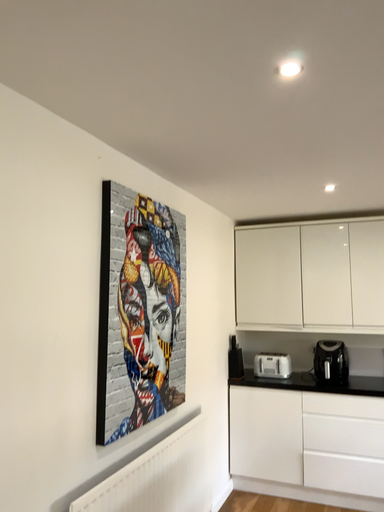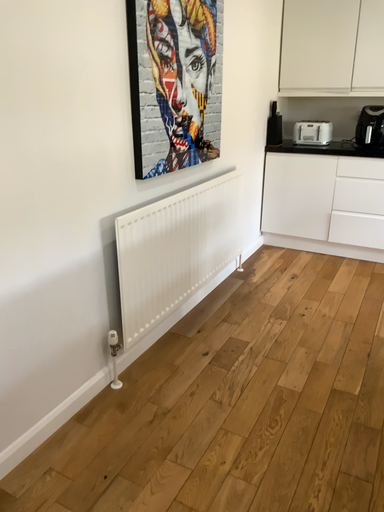
Question: Which way did the camera rotate in the video?

Choices:
 (A) rotated upward
 (B) rotated downward

Answer: (B)